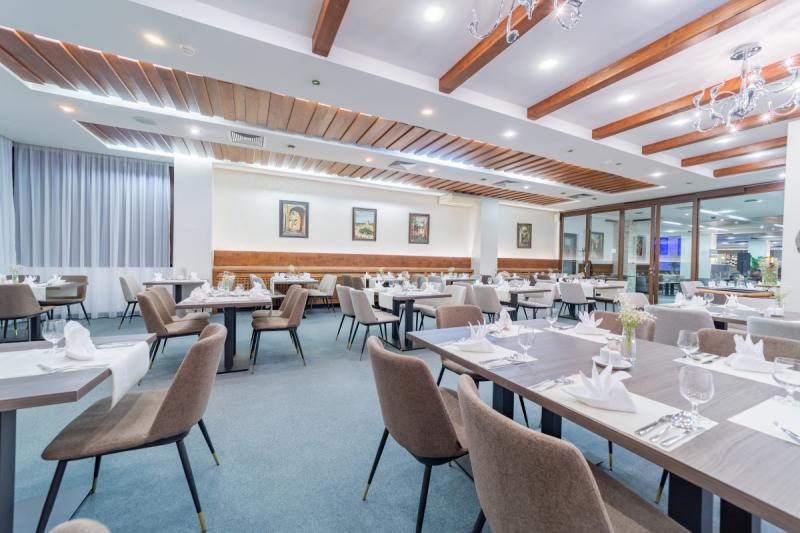
I want to click on table napkins on tables in foreground, so click(x=80, y=336), click(x=602, y=383), click(x=750, y=351), click(x=480, y=342), click(x=500, y=318), click(x=584, y=321), click(x=678, y=298), click(x=697, y=303), click(x=728, y=300).